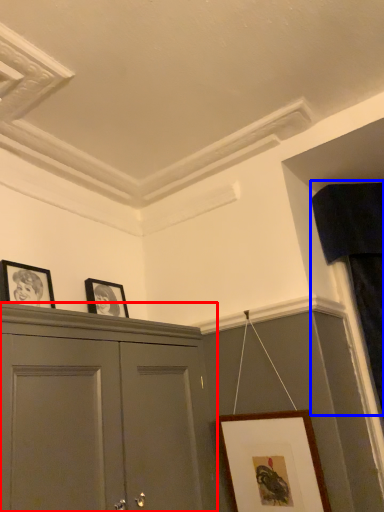
Question: Which point is further to the camera, cabinetry (highlighted by a red box) or curtain (highlighted by a blue box)?

Choices:
 (A) cabinetry
 (B) curtain

Answer: (B)